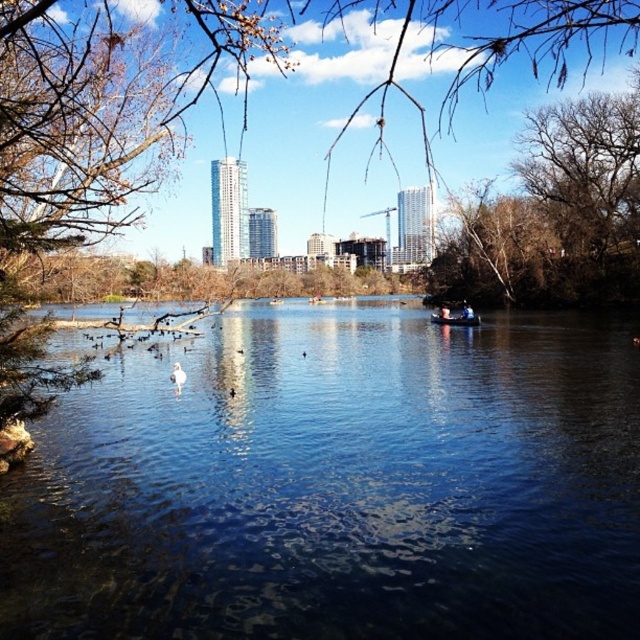
Question: Which object appears closest to the camera in this image?

Choices:
 (A) clear blue water at center
 (B) white feathered bird at center

Answer: (A)

Question: Estimate the real-world distances between objects in this image. Which object is closer to the metallic blue boat at center?

Choices:
 (A) brown textured tree at center
 (B) bare branches at upper right
 (C) white feathered bird at center

Answer: (B)

Question: Is brown textured tree at center to the right of white feathered bird at center from the viewer's perspective?

Choices:
 (A) no
 (B) yes

Answer: (B)

Question: Considering the real-world distances, which object is closest to the white feathered bird at center?

Choices:
 (A) clear blue water at center
 (B) brown textured tree at center

Answer: (A)

Question: Can you confirm if bare branches at upper right is positioned to the right of metallic blue boat at center?

Choices:
 (A) yes
 (B) no

Answer: (A)

Question: Considering the relative positions of brown textured tree at center and bare branches at upper right in the image provided, where is brown textured tree at center located with respect to bare branches at upper right?

Choices:
 (A) above
 (B) below

Answer: (A)